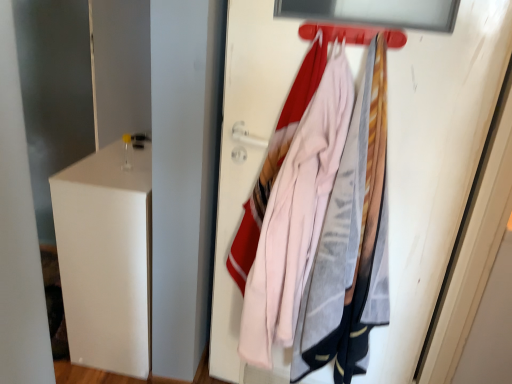
Question: Is pink fabric coat at center taller than pink fabric at upper right?

Choices:
 (A) no
 (B) yes

Answer: (A)

Question: Is pink fabric coat at center shorter than pink fabric at upper right?

Choices:
 (A) yes
 (B) no

Answer: (A)

Question: Does pink fabric coat at center have a greater width compared to pink fabric at upper right?

Choices:
 (A) no
 (B) yes

Answer: (B)

Question: Is pink fabric coat at center at the right side of pink fabric at upper right?

Choices:
 (A) no
 (B) yes

Answer: (A)

Question: From a real-world perspective, is pink fabric coat at center on pink fabric at upper right?

Choices:
 (A) yes
 (B) no

Answer: (A)

Question: From a real-world perspective, relative to white matte file cabinet at left, is pink fabric at upper right vertically above or below?

Choices:
 (A) above
 (B) below

Answer: (A)

Question: Is pink fabric at upper right inside or outside of white matte file cabinet at left?

Choices:
 (A) inside
 (B) outside

Answer: (B)

Question: Is pink fabric at upper right wider or thinner than white matte file cabinet at left?

Choices:
 (A) thin
 (B) wide

Answer: (A)

Question: Visually, is pink fabric at upper right positioned to the left or to the right of white matte file cabinet at left?

Choices:
 (A) right
 (B) left

Answer: (A)

Question: From the image's perspective, relative to pink fabric at upper right, is metallic red hanger at upper center above or below?

Choices:
 (A) below
 (B) above

Answer: (B)

Question: Is metallic red hanger at upper center inside or outside of pink fabric at upper right?

Choices:
 (A) outside
 (B) inside

Answer: (A)

Question: Considering the positions of metallic red hanger at upper center and pink fabric at upper right in the image, is metallic red hanger at upper center wider or thinner than pink fabric at upper right?

Choices:
 (A) wide
 (B) thin

Answer: (A)

Question: Is metallic red hanger at upper center taller or shorter than pink fabric at upper right?

Choices:
 (A) short
 (B) tall

Answer: (A)

Question: In the image, is metallic red hanger at upper center on the left side or the right side of pink fabric coat at center?

Choices:
 (A) left
 (B) right

Answer: (B)

Question: Is metallic red hanger at upper center wider or thinner than pink fabric coat at center?

Choices:
 (A) wide
 (B) thin

Answer: (B)